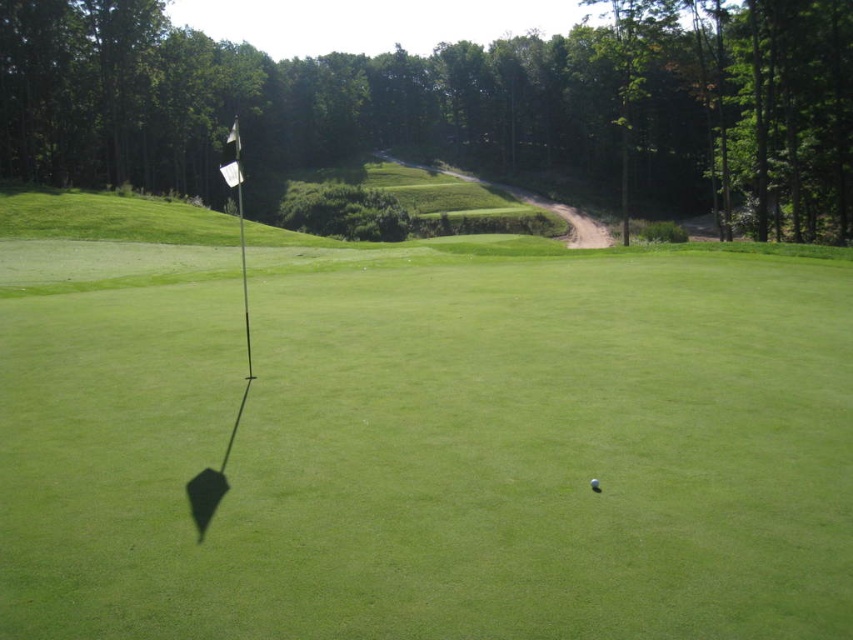
Between green grassy golf course at center and white matte golf ball at center, which one has less height?

white matte golf ball at center

Which is in front, point (838, 339) or point (596, 492)?

Point (596, 492)

This screenshot has height=640, width=853. In order to click on green grassy golf course at center in this screenshot , I will do `click(425, 444)`.